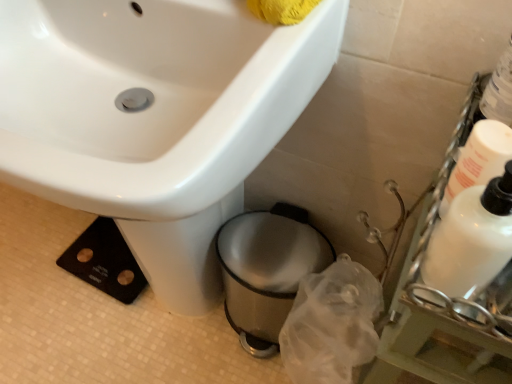
Question: Is shiny metallic trash can at lower center closer to camera compared to white glossy sink at upper left?

Choices:
 (A) yes
 (B) no

Answer: (B)

Question: From a real-world perspective, is shiny metallic trash can at lower center positioned over white glossy sink at upper left based on gravity?

Choices:
 (A) no
 (B) yes

Answer: (A)

Question: Is white glossy sink at upper left at the back of shiny metallic trash can at lower center?

Choices:
 (A) no
 (B) yes

Answer: (B)

Question: Does shiny metallic trash can at lower center have a lesser width compared to white glossy sink at upper left?

Choices:
 (A) no
 (B) yes

Answer: (B)

Question: Is white glossy sink at upper left inside shiny metallic trash can at lower center?

Choices:
 (A) yes
 (B) no

Answer: (B)

Question: In terms of size, does white glossy bottle at right, the 1th cleaning product when ordered from right to left, appear bigger or smaller than white glossy bottle at right, the 1th cleaning product when ordered from left to right?

Choices:
 (A) big
 (B) small

Answer: (B)

Question: In the image, is white glossy bottle at right, the second cleaning product viewed from the left, on the left side or the right side of white glossy bottle at right, the 1th cleaning product when ordered from left to right?

Choices:
 (A) right
 (B) left

Answer: (A)

Question: Is white glossy bottle at right, the second cleaning product viewed from the left, wider or thinner than white glossy bottle at right, acting as the 2th cleaning product starting from the right?

Choices:
 (A) thin
 (B) wide

Answer: (B)

Question: In the image, is white glossy bottle at right, the second cleaning product viewed from the left, positioned in front of or behind white glossy bottle at right, acting as the 2th cleaning product starting from the right?

Choices:
 (A) behind
 (B) front

Answer: (A)

Question: Based on their sizes in the image, would you say white glossy bottle at right, acting as the 2th cleaning product starting from the right, is bigger or smaller than white glossy bottle at right, the second cleaning product viewed from the left?

Choices:
 (A) big
 (B) small

Answer: (A)

Question: Is white glossy bottle at right, the 1th cleaning product when ordered from left to right, spatially inside white glossy bottle at right, the 1th cleaning product when ordered from right to left, or outside of it?

Choices:
 (A) outside
 (B) inside

Answer: (A)

Question: Does point (x=470, y=274) appear closer or farther from the camera than point (x=478, y=122)?

Choices:
 (A) farther
 (B) closer

Answer: (B)

Question: In the image, is white glossy bottle at right, the 1th cleaning product when ordered from left to right, positioned in front of or behind white glossy bottle at right, the 1th cleaning product when ordered from right to left?

Choices:
 (A) behind
 (B) front

Answer: (B)

Question: Is white glossy sink at upper left inside the boundaries of white glossy bottle at right, the second cleaning product viewed from the left, or outside?

Choices:
 (A) inside
 (B) outside

Answer: (B)

Question: Is point (207, 77) closer or farther from the camera than point (459, 162)?

Choices:
 (A) closer
 (B) farther

Answer: (B)